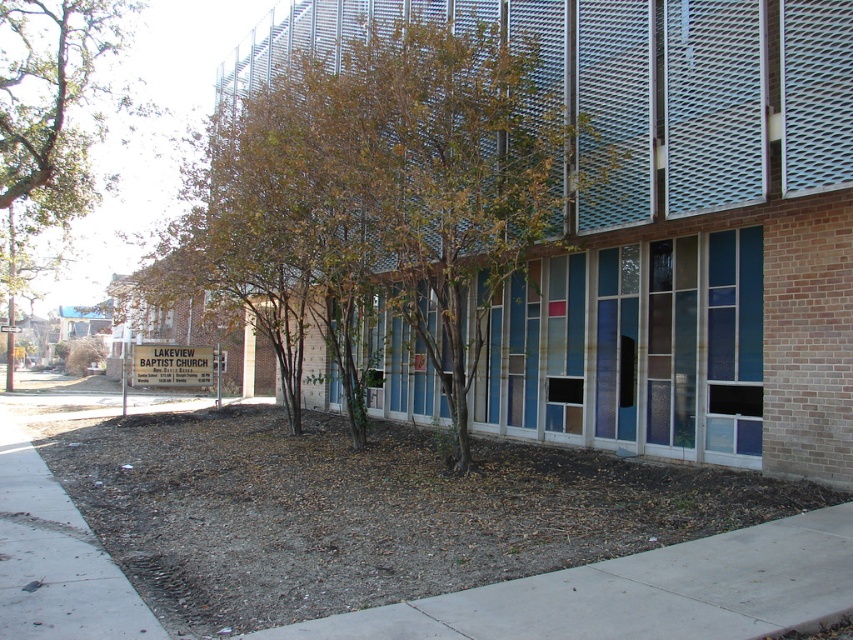
Identify the location of gray concrete sidewalk at lower center. (640, 593).

Does gray concrete sidewalk at lower center come in front of brown leafy tree at left?

Yes, gray concrete sidewalk at lower center is in front of brown leafy tree at left.

Does point (509, 598) come in front of point (13, 193)?

Yes, point (509, 598) is in front of point (13, 193).

Locate an element on the screen. gray concrete sidewalk at lower center is located at coordinates (640, 593).

Does green leafy tree at center have a larger size compared to gray concrete sidewalk at lower center?

Correct, green leafy tree at center is larger in size than gray concrete sidewalk at lower center.

Does green leafy tree at center lie in front of gray concrete sidewalk at lower center?

No, it is behind gray concrete sidewalk at lower center.

Find the location of a particular element. This screenshot has width=853, height=640. green leafy tree at center is located at coordinates (383, 198).

Can you confirm if concrete sidewalk at center is positioned to the right of gray concrete sidewalk at lower center?

In fact, concrete sidewalk at center is to the left of gray concrete sidewalk at lower center.

The image size is (853, 640). Describe the element at coordinates (640, 593) in the screenshot. I see `concrete sidewalk at center` at that location.

Which is in front, point (732, 620) or point (320, 637)?

Point (320, 637) is more forward.

Where is `concrete sidewalk at center`? concrete sidewalk at center is located at coordinates (640, 593).